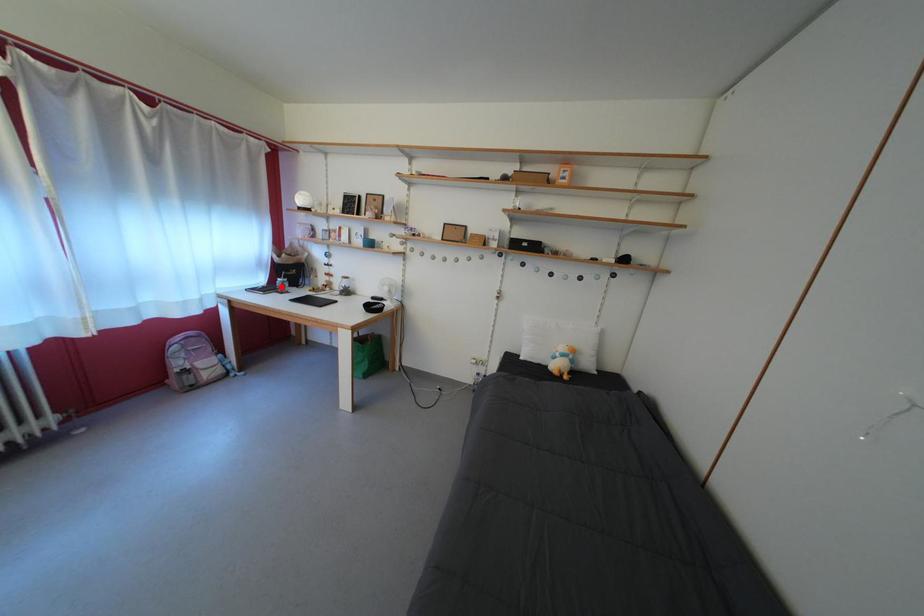
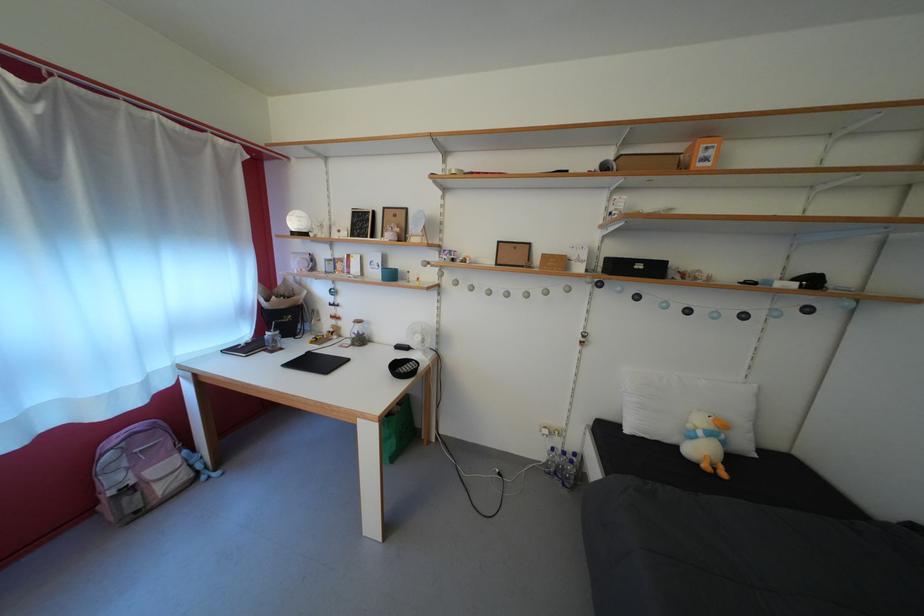
Where in the second image is the point corresponding to the highlighted location from the first image?

(268, 339)